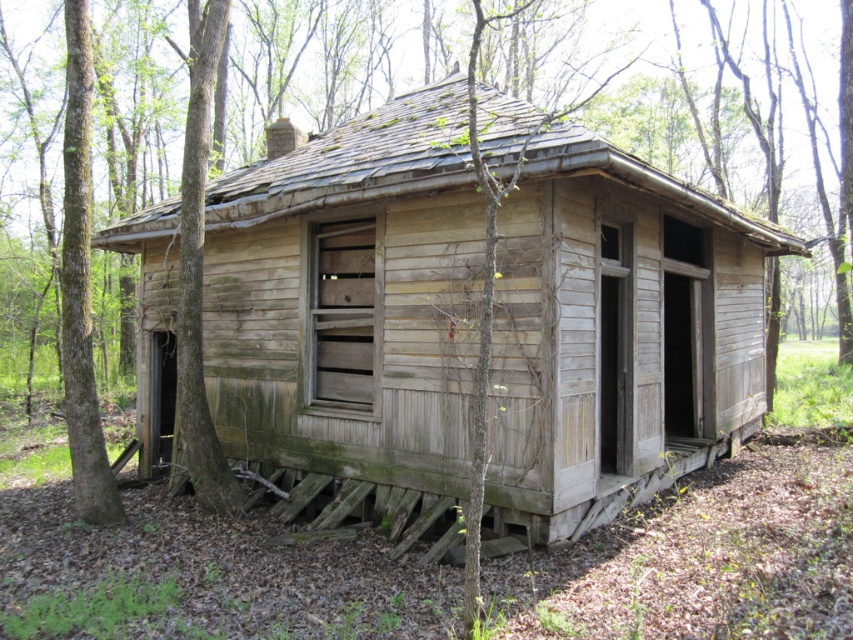
Question: Does weathered wood cabin at center appear on the left side of smooth brown bark at left?

Choices:
 (A) no
 (B) yes

Answer: (A)

Question: Which point is farther to the camera?

Choices:
 (A) (80, 461)
 (B) (656, 276)

Answer: (B)

Question: Considering the relative positions of weathered wood cabin at center and smooth brown bark at left in the image provided, where is weathered wood cabin at center located with respect to smooth brown bark at left?

Choices:
 (A) right
 (B) left

Answer: (A)

Question: Is weathered wood cabin at center further to the viewer compared to smooth brown bark at left?

Choices:
 (A) no
 (B) yes

Answer: (B)